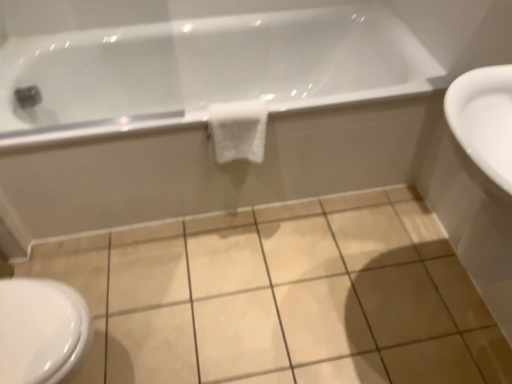
Question: Is beige ceramic tile at center positioned beyond the bounds of white glossy sink at right?

Choices:
 (A) no
 (B) yes

Answer: (B)

Question: Considering the relative positions of beige ceramic tile at center and white glossy sink at right in the image provided, is beige ceramic tile at center to the left of white glossy sink at right from the viewer's perspective?

Choices:
 (A) yes
 (B) no

Answer: (A)

Question: Is white glossy sink at right surrounded by beige ceramic tile at center?

Choices:
 (A) yes
 (B) no

Answer: (B)

Question: From a real-world perspective, is beige ceramic tile at center under white glossy sink at right?

Choices:
 (A) yes
 (B) no

Answer: (A)

Question: From the image's perspective, is beige ceramic tile at center below white glossy sink at right?

Choices:
 (A) no
 (B) yes

Answer: (B)

Question: Does point (215, 160) appear closer or farther from the camera than point (256, 304)?

Choices:
 (A) farther
 (B) closer

Answer: (A)

Question: Is white glossy bathtub at upper center wider or thinner than beige ceramic tile at center?

Choices:
 (A) wide
 (B) thin

Answer: (B)

Question: Do you think white glossy bathtub at upper center is within beige ceramic tile at center, or outside of it?

Choices:
 (A) inside
 (B) outside

Answer: (B)

Question: Is white glossy bathtub at upper center bigger or smaller than beige ceramic tile at center?

Choices:
 (A) small
 (B) big

Answer: (B)

Question: Based on their sizes in the image, would you say white glossy bidet at lower left is bigger or smaller than white glossy sink at right?

Choices:
 (A) big
 (B) small

Answer: (B)

Question: From a real-world perspective, is white glossy bidet at lower left physically located above or below white glossy sink at right?

Choices:
 (A) above
 (B) below

Answer: (B)

Question: From the image's perspective, is white glossy bidet at lower left above or below white glossy sink at right?

Choices:
 (A) below
 (B) above

Answer: (A)

Question: Is white glossy bidet at lower left situated inside white glossy sink at right or outside?

Choices:
 (A) inside
 (B) outside

Answer: (B)

Question: In terms of size, does white glossy bathtub at upper center appear bigger or smaller than white glossy bidet at lower left?

Choices:
 (A) small
 (B) big

Answer: (B)

Question: From the image's perspective, relative to white glossy bidet at lower left, is white glossy bathtub at upper center above or below?

Choices:
 (A) below
 (B) above

Answer: (B)